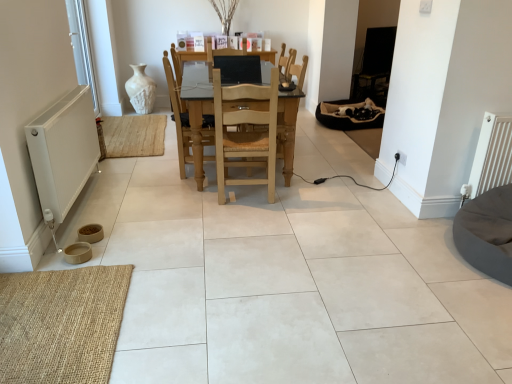
Question: In terms of size, does dark gray fabric bean bag at lower right, which appears as the 2th bean bag chair when viewed from the top, appear bigger or smaller than white plastic window screen at left?

Choices:
 (A) big
 (B) small

Answer: (A)

Question: Do you think dark gray fabric bean bag at lower right, arranged as the second bean bag chair when viewed from the back, is within white plastic window screen at left, or outside of it?

Choices:
 (A) outside
 (B) inside

Answer: (A)

Question: Which object is positioned farthest from the dark gray fabric bean bag at lower right, which appears as the 2th bean bag chair when viewed from the top?

Choices:
 (A) natural wood/rattan chair at center, placed as the first chair when sorted from right to left
 (B) white plastic window screen at left
 (C) light wood table at center
 (D) matte black monitor at center
 (E) burlap mat at lower left

Answer: (B)

Question: Which of these objects is positioned closest to the natural wood/rattan chair at center, the 2th chair when ordered from left to right?

Choices:
 (A) dark gray fabric bean bag at lower right, which appears as the 2th bean bag chair when viewed from the top
 (B) light wood chair at center, the first chair when ordered from left to right
 (C) matte black monitor at center
 (D) light wood table at center
 (E) white plastic window screen at left

Answer: (D)